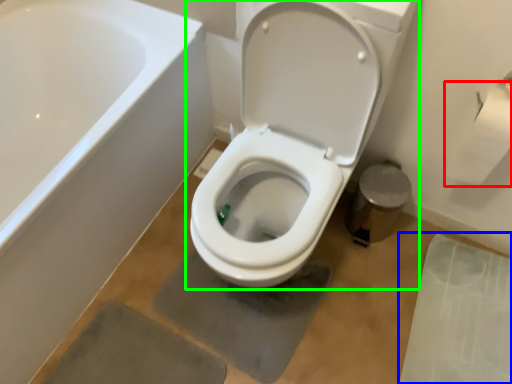
Question: Considering the real-world distances, which object is farthest from toilet paper (highlighted by a red box)? concrete (highlighted by a blue box) or toilet (highlighted by a green box)?

Choices:
 (A) concrete
 (B) toilet

Answer: (A)